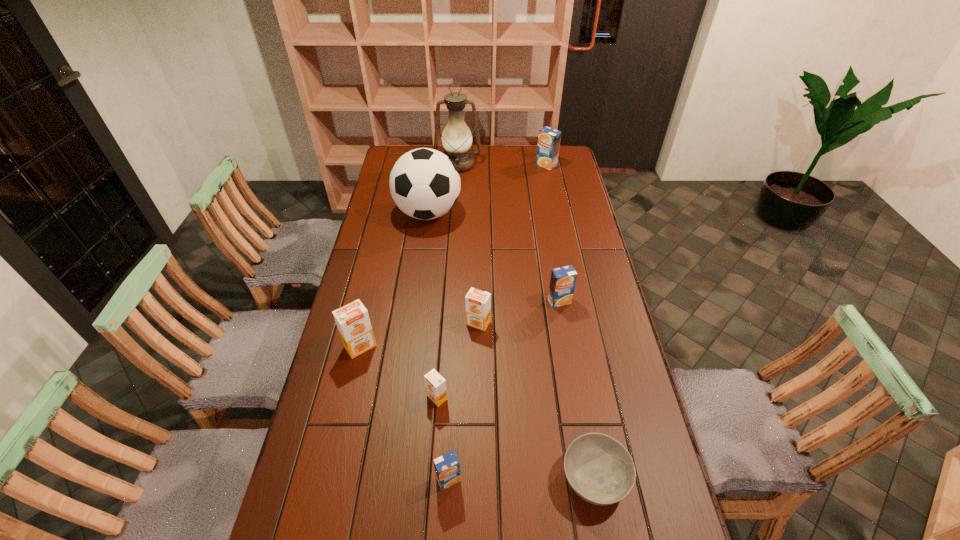
Image resolution: width=960 pixels, height=540 pixels. I want to click on vacant space positioned 0.200m on the left of the second farthest orange juice, so click(x=491, y=301).

This screenshot has height=540, width=960. I want to click on free spot located 0.390m on the left of the rightmost orange orange juice, so click(x=348, y=323).

This screenshot has height=540, width=960. I want to click on blank space located on the back of the leftmost blue orange_juice, so click(453, 383).

This screenshot has width=960, height=540. Find the location of `blank space located on the right of the second nearest orange juice`. blank space located on the right of the second nearest orange juice is located at coordinates (472, 397).

You are a GUI agent. You are given a task and a screenshot of the screen. Output one action in this format:
    pyautogui.click(x=<x>, y=<y>)
    Task: Click on the free space located 0.390m on the back of the bowl
    This screenshot has height=540, width=960.
    Given the screenshot: What is the action you would take?
    pyautogui.click(x=568, y=328)

The width and height of the screenshot is (960, 540). Find the location of `oil lamp that is at the far edge`. oil lamp that is at the far edge is located at coordinates coord(457,138).

Locate an element on the screen. orange_juice at the far edge is located at coordinates (x=549, y=139).

The height and width of the screenshot is (540, 960). What are the coordinates of `soccer ball at the left edge` in the screenshot? It's located at (424, 183).

Find the location of a particular element. The height and width of the screenshot is (540, 960). orange juice that is at the left edge is located at coordinates (352, 320).

Where is `bowl that is at the right edge`? The height and width of the screenshot is (540, 960). bowl that is at the right edge is located at coordinates (600, 470).